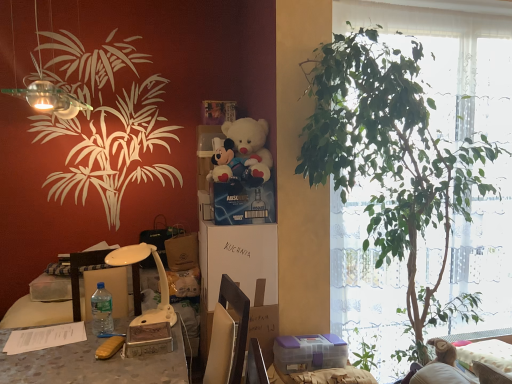
Question: Is wooden box at center, acting as the second box starting from the bottom, facing away from green leafy plant at right?

Choices:
 (A) yes
 (B) no

Answer: (B)

Question: From a real-world perspective, is wooden box at center, the third box viewed from the right, on top of green leafy plant at right?

Choices:
 (A) yes
 (B) no

Answer: (B)

Question: From the image's perspective, would you say wooden box at center, acting as the second box starting from the bottom, is positioned over green leafy plant at right?

Choices:
 (A) no
 (B) yes

Answer: (A)

Question: Considering the relative sizes of wooden box at center, which is counted as the first box, starting from the front, and green leafy plant at right in the image provided, is wooden box at center, which is counted as the first box, starting from the front, bigger than green leafy plant at right?

Choices:
 (A) no
 (B) yes

Answer: (A)

Question: Does wooden box at center, acting as the second box starting from the bottom, have a lesser width compared to green leafy plant at right?

Choices:
 (A) no
 (B) yes

Answer: (B)

Question: Considering the relative sizes of wooden box at center, which appears as the third box when viewed from the top, and green leafy plant at right in the image provided, is wooden box at center, which appears as the third box when viewed from the top, smaller than green leafy plant at right?

Choices:
 (A) no
 (B) yes

Answer: (B)

Question: Is white plush teddy bear at center surrounded by green leafy plant at right?

Choices:
 (A) yes
 (B) no

Answer: (B)

Question: Does green leafy plant at right have a lesser height compared to white plush teddy bear at center?

Choices:
 (A) no
 (B) yes

Answer: (A)

Question: Is green leafy plant at right bigger than white plush teddy bear at center?

Choices:
 (A) yes
 (B) no

Answer: (A)

Question: Does green leafy plant at right turn towards white plush teddy bear at center?

Choices:
 (A) no
 (B) yes

Answer: (A)

Question: From a real-world perspective, is green leafy plant at right positioned over white plush teddy bear at center based on gravity?

Choices:
 (A) yes
 (B) no

Answer: (B)

Question: From the image's perspective, would you say green leafy plant at right is shown under white plush teddy bear at center?

Choices:
 (A) no
 (B) yes

Answer: (B)

Question: Can you confirm if wooden box at center, the third box viewed from the right, is bigger than white plastic lamp at lower left, marked as the 1th lamp in a back-to-front arrangement?

Choices:
 (A) yes
 (B) no

Answer: (B)